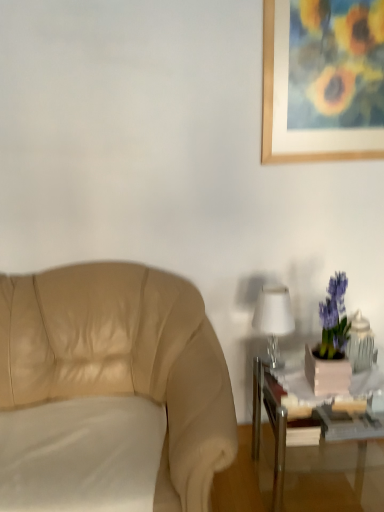
Question: Is metallic silver table at lower right outside of wooden picture frame at upper right?

Choices:
 (A) no
 (B) yes

Answer: (B)

Question: Is metallic silver table at lower right far away from wooden picture frame at upper right?

Choices:
 (A) no
 (B) yes

Answer: (B)

Question: Is metallic silver table at lower right bigger than wooden picture frame at upper right?

Choices:
 (A) yes
 (B) no

Answer: (A)

Question: Is metallic silver table at lower right looking in the opposite direction of wooden picture frame at upper right?

Choices:
 (A) no
 (B) yes

Answer: (A)

Question: From a real-world perspective, is metallic silver table at lower right under wooden picture frame at upper right?

Choices:
 (A) yes
 (B) no

Answer: (A)

Question: Can you confirm if metallic silver table at lower right is thinner than wooden picture frame at upper right?

Choices:
 (A) no
 (B) yes

Answer: (A)

Question: From the image's perspective, is beige leather chair at left located beneath white glossy table lamp at right?

Choices:
 (A) yes
 (B) no

Answer: (A)

Question: From the image's perspective, is beige leather chair at left on top of white glossy table lamp at right?

Choices:
 (A) no
 (B) yes

Answer: (A)

Question: Is beige leather chair at left to the right of white glossy table lamp at right from the viewer's perspective?

Choices:
 (A) no
 (B) yes

Answer: (A)

Question: Is beige leather chair at left outside of white glossy table lamp at right?

Choices:
 (A) yes
 (B) no

Answer: (A)

Question: Is beige leather chair at left at the left side of white glossy table lamp at right?

Choices:
 (A) no
 (B) yes

Answer: (B)

Question: Does beige leather chair at left have a greater width compared to white glossy table lamp at right?

Choices:
 (A) yes
 (B) no

Answer: (A)

Question: Is white glossy table lamp at right bigger than beige leather chair at left?

Choices:
 (A) yes
 (B) no

Answer: (B)